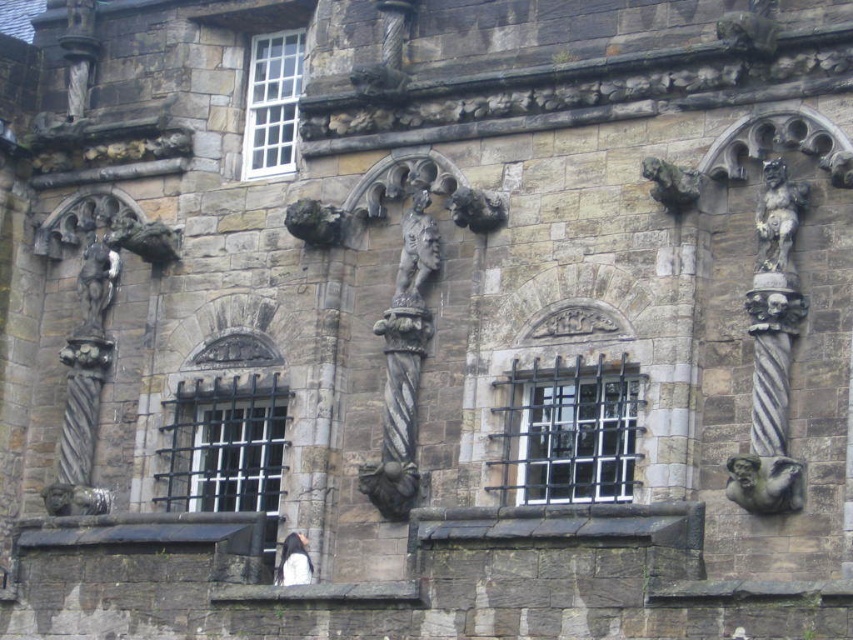
Question: Estimate the real-world distances between objects in this image. Which object is farther from the matte stone gargoyle at center?

Choices:
 (A) bronze textured figure at center
 (B) black metal window at center
 (C) white fur at center

Answer: (C)

Question: Is polished stone statue at upper left to the right of dark gray stone gargoyle at upper right from the viewer's perspective?

Choices:
 (A) yes
 (B) no

Answer: (B)

Question: Which point is farther to the camera?

Choices:
 (A) matte stone gargoyle at center
 (B) gray stone gargoyle at lower left
 (C) stone gargoyle at upper right
 (D) dark gray stone gargoyle at upper right

Answer: (B)

Question: Estimate the real-world distances between objects in this image. Which object is closer to the dark gray stone gargoyle at upper right?

Choices:
 (A) black metal bars at center
 (B) dark gray stone gargoyle at center
 (C) matte stone gargoyle at center
 (D) stone gargoyle at upper right

Answer: (D)

Question: Is polished stone statue at upper left further to the viewer compared to white fur at center?

Choices:
 (A) yes
 (B) no

Answer: (A)

Question: Does white wooden window at upper center come behind matte stone gargoyle at center?

Choices:
 (A) yes
 (B) no

Answer: (A)